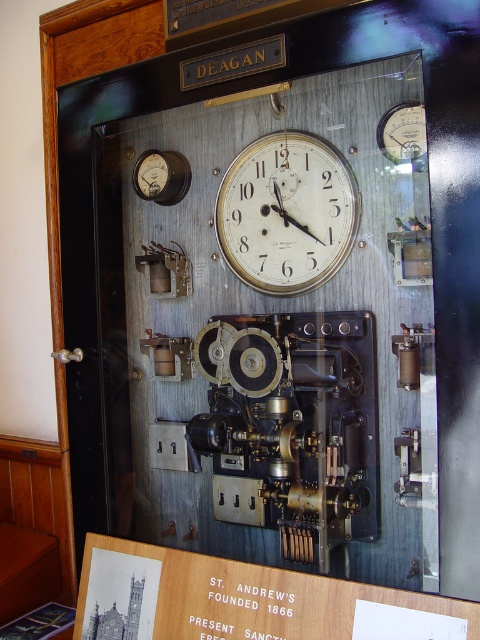
Question: Can you confirm if white metallic clock at center is positioned above matte silver gauge at upper right?

Choices:
 (A) no
 (B) yes

Answer: (A)

Question: Which point is farther to the camera?

Choices:
 (A) pyautogui.click(x=405, y=156)
 (B) pyautogui.click(x=259, y=179)

Answer: (B)

Question: Which point is farther to the camera?

Choices:
 (A) white metallic clock at center
 (B) matte silver gauge at upper right

Answer: (A)

Question: Can you confirm if white metallic clock at center is bigger than matte silver gauge at upper right?

Choices:
 (A) no
 (B) yes

Answer: (B)

Question: Does white metallic clock at center appear under matte silver gauge at upper right?

Choices:
 (A) no
 (B) yes

Answer: (B)